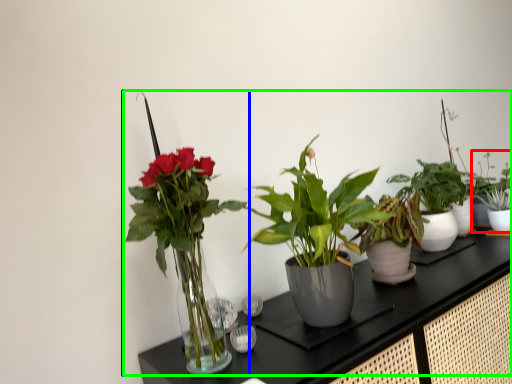
Question: Which object is the farthest from houseplant (highlighted by a red box)? Choose among these: houseplant (highlighted by a blue box) or houseplant (highlighted by a green box).

Choices:
 (A) houseplant
 (B) houseplant

Answer: (A)